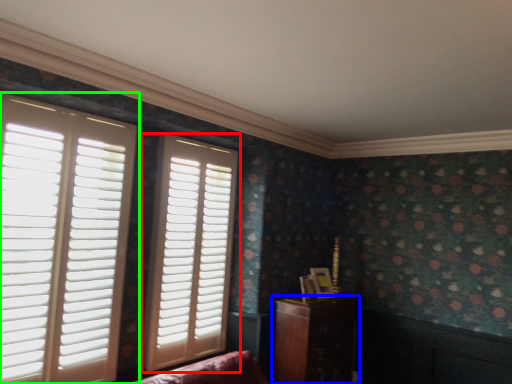
Question: Which object is the closest to the window (highlighted by a red box)? Choose among these: furniture (highlighted by a blue box) or window (highlighted by a green box).

Choices:
 (A) furniture
 (B) window

Answer: (B)